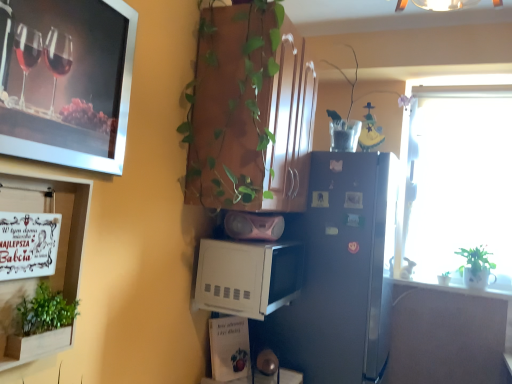
Where is `white matte microwave at center, which is counted as the first appliance, starting from the bottom`? The image size is (512, 384). white matte microwave at center, which is counted as the first appliance, starting from the bottom is located at coordinates (247, 277).

What do you see at coordinates (247, 277) in the screenshot? I see `white matte microwave at center, which is the second appliance from top to bottom` at bounding box center [247, 277].

Image resolution: width=512 pixels, height=384 pixels. What do you see at coordinates (42, 324) in the screenshot? I see `green leafy plant at lower left, which is counted as the second houseplant, starting from the top` at bounding box center [42, 324].

Image resolution: width=512 pixels, height=384 pixels. I want to click on green leafy plant at lower left, arranged as the third houseplant when viewed from the back, so click(x=42, y=324).

Where is `wooden cabinet at upper center`? wooden cabinet at upper center is located at coordinates (249, 111).

Identify the location of wooden signboard at left. The image size is (512, 384). (58, 246).

Identify the location of white matte microwave at center, which is counted as the first appliance, starting from the bottom. This screenshot has height=384, width=512. pos(247,277).

Looking at this image, is green leafy plant at lower left, the first houseplant viewed from the left, beside silver metallic picture frame at upper left?

No, green leafy plant at lower left, the first houseplant viewed from the left, is not next to silver metallic picture frame at upper left.

This screenshot has width=512, height=384. What are the coordinates of `houseplant on the left of silver metallic picture frame at upper left` in the screenshot? It's located at (42, 324).

What's the angular difference between green leafy plant at lower left, marked as the third houseplant in a right-to-left arrangement, and silver metallic picture frame at upper left's facing directions?

The facing directions of green leafy plant at lower left, marked as the third houseplant in a right-to-left arrangement, and silver metallic picture frame at upper left are 2.39 degrees apart.

Considering their positions, is green leafy plant at lower left, marked as the third houseplant in a right-to-left arrangement, located in front of or behind silver metallic picture frame at upper left?

Clearly, green leafy plant at lower left, marked as the third houseplant in a right-to-left arrangement, is behind silver metallic picture frame at upper left.

Could silver metallic picture frame at upper left be considered to be inside wooden signboard at left?

No, silver metallic picture frame at upper left is located outside of wooden signboard at left.

Considering the relative positions of wooden signboard at left and silver metallic picture frame at upper left in the image provided, is wooden signboard at left behind silver metallic picture frame at upper left?

That is True.

Which object is wider, wooden signboard at left or silver metallic picture frame at upper left?

With larger width is wooden signboard at left.

Would you say white glossy counter top at right is outside silver metallic picture frame at upper left?

white glossy counter top at right is positioned outside silver metallic picture frame at upper left.

From a real-world perspective, which is physically below, white glossy counter top at right or silver metallic picture frame at upper left?

From a 3D spatial view, white glossy counter top at right is below.

Does white glossy counter top at right touch silver metallic picture frame at upper left?

No, white glossy counter top at right is not with silver metallic picture frame at upper left.

Could you measure the distance between white glossy counter top at right and silver metallic picture frame at upper left?

6.64 feet.

In the image, is pink matte speaker at center, positioned as the 2th appliance in bottom-to-top order, positioned in front of or behind wooden signboard at left?

pink matte speaker at center, positioned as the 2th appliance in bottom-to-top order, is positioned farther from the viewer than wooden signboard at left.

Between pink matte speaker at center, positioned as the 2th appliance in bottom-to-top order, and wooden signboard at left, which one appears on the left side from the viewer's perspective?

Positioned to the left is wooden signboard at left.

From the image's perspective, does pink matte speaker at center, positioned as the 2th appliance in bottom-to-top order, appear higher than wooden signboard at left?

Yes.

The width and height of the screenshot is (512, 384). Find the location of `shelf that is under the pink matte speaker at center, placed as the 1th appliance when sorted from top to bottom (from a real-world perspective)`. shelf that is under the pink matte speaker at center, placed as the 1th appliance when sorted from top to bottom (from a real-world perspective) is located at coordinates (58, 246).

Measure the distance from green matte plant at right, arranged as the 1th houseplant when ordered from the bottom, to translucent plastic vase at upper center, the second houseplant viewed from the right.

green matte plant at right, arranged as the 1th houseplant when ordered from the bottom, is 36.04 inches from translucent plastic vase at upper center, the second houseplant viewed from the right.

Is green matte plant at right, which is the 3th houseplant in front-to-back order, spatially inside translucent plastic vase at upper center, the second houseplant viewed from the left, or outside of it?

green matte plant at right, which is the 3th houseplant in front-to-back order, is spatially situated outside translucent plastic vase at upper center, the second houseplant viewed from the left.

Considering the relative sizes of green matte plant at right, the 3th houseplant viewed from the top, and translucent plastic vase at upper center, which is the 2th houseplant from front to back, in the image provided, is green matte plant at right, the 3th houseplant viewed from the top, wider than translucent plastic vase at upper center, which is the 2th houseplant from front to back,?

In fact, green matte plant at right, the 3th houseplant viewed from the top, might be narrower than translucent plastic vase at upper center, which is the 2th houseplant from front to back.

There is a green matte plant at right, the 3th houseplant viewed from the top. Where is `the 2nd houseplant above it (from the image's perspective)`? the 2nd houseplant above it (from the image's perspective) is located at coordinates (361, 108).

How distant is pink matte speaker at center, positioned as the 2th appliance in bottom-to-top order, from satin silver refrigerator at center?

pink matte speaker at center, positioned as the 2th appliance in bottom-to-top order, is 17.73 inches from satin silver refrigerator at center.

Does pink matte speaker at center, positioned as the 2th appliance in bottom-to-top order, appear on the right side of satin silver refrigerator at center?

No.

Between point (262, 224) and point (380, 177), which one is positioned in front?

The point (262, 224) is closer.

Based on their sizes in the image, would you say pink matte speaker at center, positioned as the 2th appliance in bottom-to-top order, is bigger or smaller than satin silver refrigerator at center?

Clearly, pink matte speaker at center, positioned as the 2th appliance in bottom-to-top order, is smaller in size than satin silver refrigerator at center.

Would you say wooden signboard at left contains pink matte speaker at center, positioned as the 2th appliance in bottom-to-top order?

No, pink matte speaker at center, positioned as the 2th appliance in bottom-to-top order, is not inside wooden signboard at left.

Does wooden signboard at left have a greater height compared to pink matte speaker at center, positioned as the 2th appliance in bottom-to-top order?

Indeed, wooden signboard at left has a greater height compared to pink matte speaker at center, positioned as the 2th appliance in bottom-to-top order.

From a real-world perspective, is wooden signboard at left on top of pink matte speaker at center, positioned as the 2th appliance in bottom-to-top order?

No, from a real-world perspective, wooden signboard at left is not on top of pink matte speaker at center, positioned as the 2th appliance in bottom-to-top order.

Looking at this image, what's the angular difference between wooden signboard at left and pink matte speaker at center, positioned as the 2th appliance in bottom-to-top order,'s facing directions?

40.9 degrees separate the facing orientations of wooden signboard at left and pink matte speaker at center, positioned as the 2th appliance in bottom-to-top order.

Find the location of a particular element. picture frame above the green leafy plant at lower left, marked as the third houseplant in a right-to-left arrangement (from a real-world perspective) is located at coordinates (67, 81).

Identify the location of picture frame above the wooden signboard at left (from the image's perspective). Image resolution: width=512 pixels, height=384 pixels. (67, 81).

Based on the photo, which object lies nearer to the anchor point wooden cabinet at upper center, pink matte speaker at center, positioned as the 2th appliance in bottom-to-top order, or white matte microwave at center, which is counted as the first appliance, starting from the bottom?

pink matte speaker at center, positioned as the 2th appliance in bottom-to-top order.

When comparing their distances from satin silver refrigerator at center, does wooden signboard at left or silver metallic picture frame at upper left seem further?

silver metallic picture frame at upper left.

When comparing their distances from wooden signboard at left, does pink matte speaker at center, positioned as the 2th appliance in bottom-to-top order, or silver metallic picture frame at upper left seem further?

pink matte speaker at center, positioned as the 2th appliance in bottom-to-top order.

Based on the photo, which object lies nearer to the anchor point pink matte speaker at center, placed as the 1th appliance when sorted from top to bottom, wooden signboard at left or translucent plastic vase at upper center, the 3th houseplant positioned from the bottom?

wooden signboard at left lies closer to pink matte speaker at center, placed as the 1th appliance when sorted from top to bottom, than the other object.

From the image, which object appears to be nearer to green leafy plant at lower left, which appears as the 1th houseplant when viewed from the front, green matte plant at right, which ranks as the 3th houseplant in left-to-right order, or white matte microwave at center, which is the second appliance from top to bottom?

white matte microwave at center, which is the second appliance from top to bottom, lies closer to green leafy plant at lower left, which appears as the 1th houseplant when viewed from the front, than the other object.

Looking at the image, which one is located further to green matte plant at right, the 3th houseplant viewed from the top, white matte microwave at center, which is the second appliance from top to bottom, or wooden signboard at left?

wooden signboard at left.

From the image, which object appears to be nearer to green matte plant at right, marked as the first houseplant in a back-to-front arrangement, white glossy counter top at right or wooden signboard at left?

Based on the image, white glossy counter top at right appears to be nearer to green matte plant at right, marked as the first houseplant in a back-to-front arrangement.

Estimate the real-world distances between objects in this image. Which object is further from pink matte speaker at center, positioned as the 2th appliance in bottom-to-top order, wooden signboard at left or green matte plant at right, which ranks as the 3th houseplant in left-to-right order?

green matte plant at right, which ranks as the 3th houseplant in left-to-right order.

I want to click on shelf between silver metallic picture frame at upper left and green leafy plant at lower left, the first houseplant viewed from the left, from top to bottom, so click(x=58, y=246).

Where is `refrigerator between wooden cabinet at upper center and white glossy counter top at right from left to right`? refrigerator between wooden cabinet at upper center and white glossy counter top at right from left to right is located at coordinates coord(339,273).

The height and width of the screenshot is (384, 512). Find the location of `cabinetry between green leafy plant at lower left, the second houseplant when ordered from bottom to top, and white glossy counter top at right from left to right`. cabinetry between green leafy plant at lower left, the second houseplant when ordered from bottom to top, and white glossy counter top at right from left to right is located at coordinates (249, 111).

I want to click on appliance between white matte microwave at center, which is the second appliance from top to bottom, and white glossy counter top at right, in the horizontal direction, so click(253, 226).